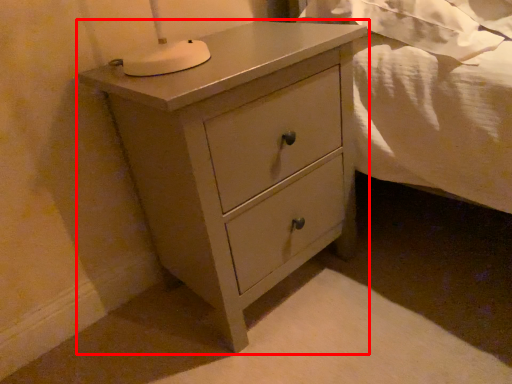
Question: From the image's perspective, where is chest of drawers (annotated by the red box) located in relation to sheet in the image?

Choices:
 (A) above
 (B) below

Answer: (B)